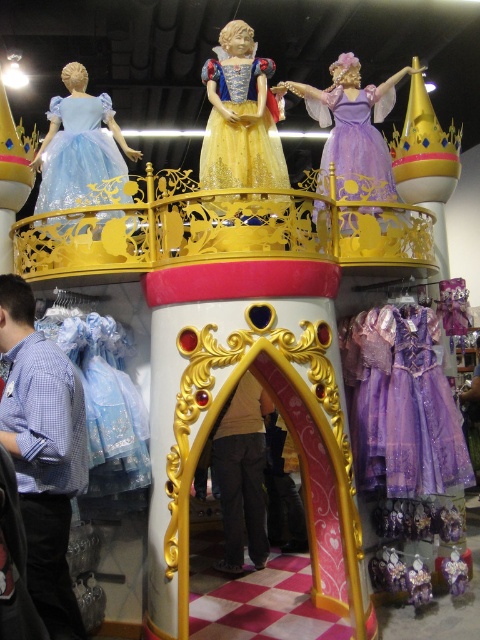
Which is above, golden sequined dress at center or purple satin dress at center?

purple satin dress at center is above.

Who is shorter, golden sequined dress at center or purple satin dress at center?

With less height is golden sequined dress at center.

Measure the distance between golden sequined dress at center and camera.

The distance of golden sequined dress at center from camera is 3.24 meters.

Find the location of a particular element. The width and height of the screenshot is (480, 640). golden sequined dress at center is located at coordinates (241, 129).

Measure the distance between blue checkered shirt at left and camera.

They are 7.47 feet apart.

Is blue checkered shirt at left above lavender satin dress at center?

Incorrect, blue checkered shirt at left is not positioned above lavender satin dress at center.

Is point (15, 344) positioned before point (360, 115)?

Yes.

This screenshot has width=480, height=640. I want to click on blue checkered shirt at left, so click(x=43, y=452).

Locate an element on the screen. The image size is (480, 640). light blue satin dress at left is located at coordinates (82, 156).

In the scene shown: Does light blue satin dress at left lie in front of dark gray pants at center?

Yes, it is.

Between point (51, 177) and point (236, 392), which one is positioned behind?

The point (236, 392) is more distant.

Where is `light blue satin dress at left`? light blue satin dress at left is located at coordinates (82, 156).